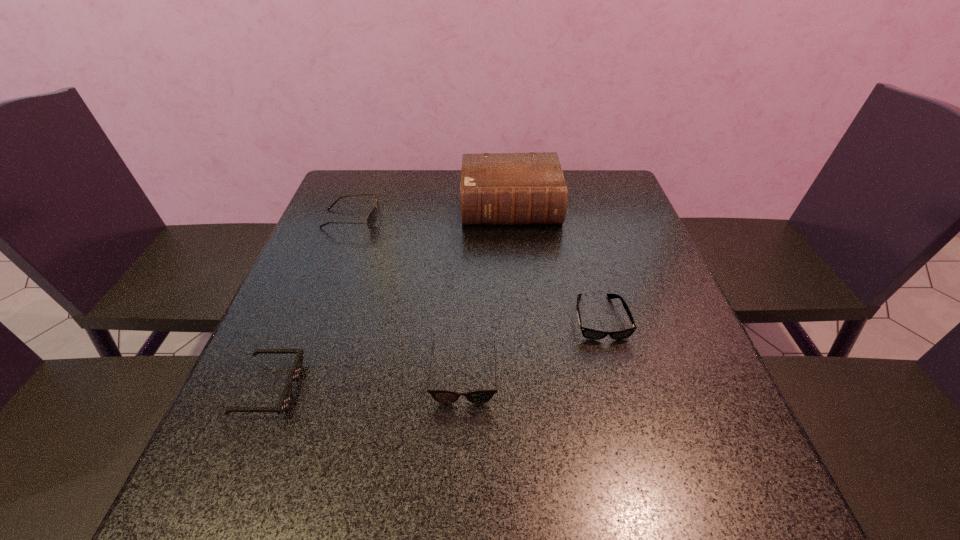
This screenshot has height=540, width=960. In order to click on vacant area that lies between the rightmost sunglasses and the tallest object in this screenshot , I will do `click(555, 262)`.

Find the location of a particular element. Image resolution: width=960 pixels, height=540 pixels. vacant area between the third sunglasses from left to right and the tallest object is located at coordinates (487, 291).

This screenshot has height=540, width=960. In order to click on empty space between the farthest sunglasses and the second sunglasses from right to left in this screenshot , I will do `click(408, 297)`.

Locate an element on the screen. This screenshot has height=540, width=960. unoccupied position between the tallest object and the third farthest object is located at coordinates (555, 262).

Find the location of a particular element. free point between the third nearest object and the second sunglasses from right to left is located at coordinates (532, 346).

This screenshot has height=540, width=960. Find the location of `blank region between the farthest sunglasses and the tallest object`. blank region between the farthest sunglasses and the tallest object is located at coordinates (431, 213).

This screenshot has width=960, height=540. What are the coordinates of `vacant point located between the Bible and the tallest sunglasses` in the screenshot? It's located at (x=431, y=213).

This screenshot has width=960, height=540. What are the coordinates of `free space between the third nearest object and the second tallest object` in the screenshot? It's located at (476, 268).

At what (x,y) coordinates should I click in order to perform the action: click on vacant region between the third sunglasses from left to right and the tallest sunglasses. Please return your answer as a coordinate pair (x, y). Image resolution: width=960 pixels, height=540 pixels. Looking at the image, I should click on (408, 297).

You are a GUI agent. You are given a task and a screenshot of the screen. Output one action in this format:
    pyautogui.click(x=<x>, y=<y>)
    Task: Click on the object that stands as the closest to the tallest sunglasses
    The height and width of the screenshot is (540, 960).
    Given the screenshot: What is the action you would take?
    pyautogui.click(x=496, y=188)